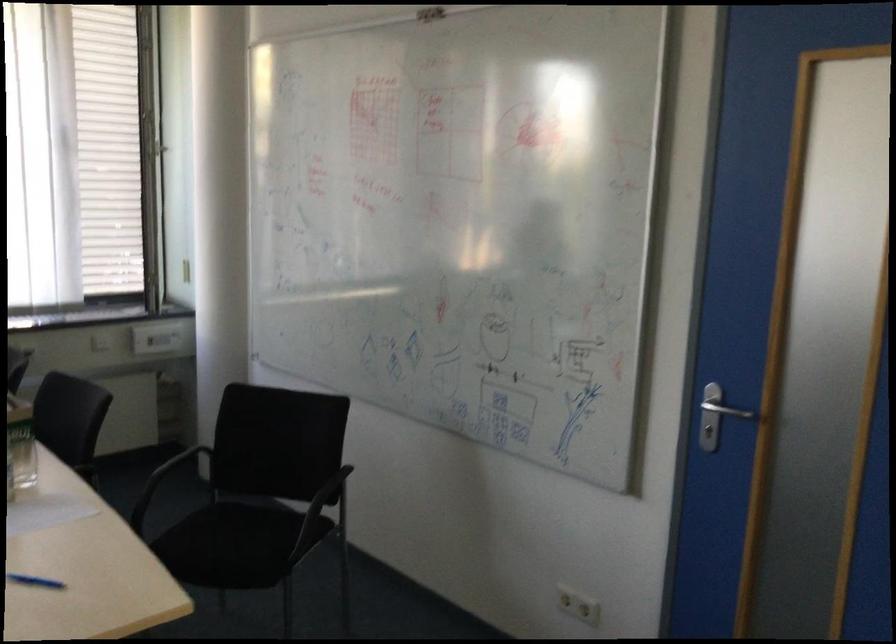
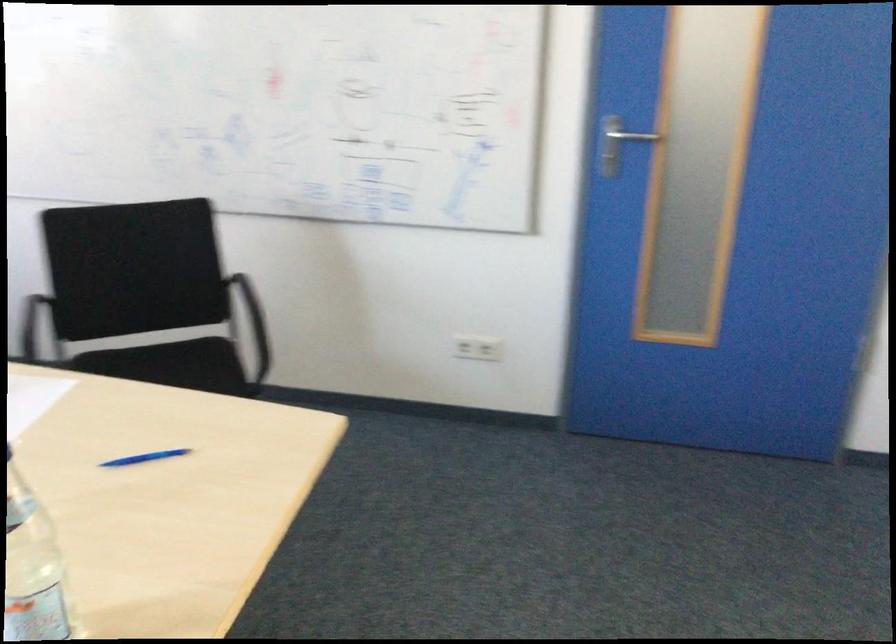
Locate, in the second image, the point that corresponds to point (268, 534) in the first image.

(194, 364)